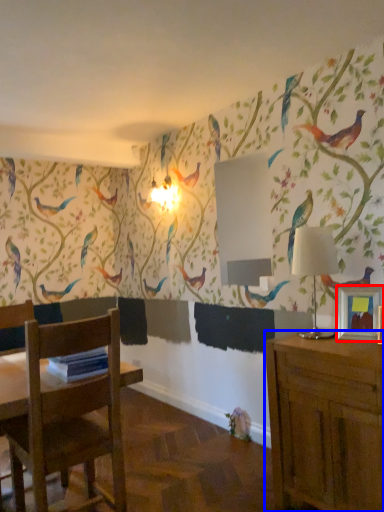
Question: Which point is further to the camera, picture frame (highlighted by a red box) or cabinetry (highlighted by a blue box)?

Choices:
 (A) picture frame
 (B) cabinetry

Answer: (A)